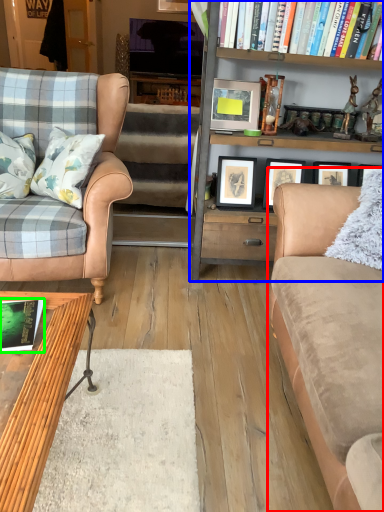
Question: Which object is positioned closest to studio couch (highlighted by a red box)? Select from bookcase (highlighted by a blue box) and book (highlighted by a green box).

Choices:
 (A) bookcase
 (B) book

Answer: (A)